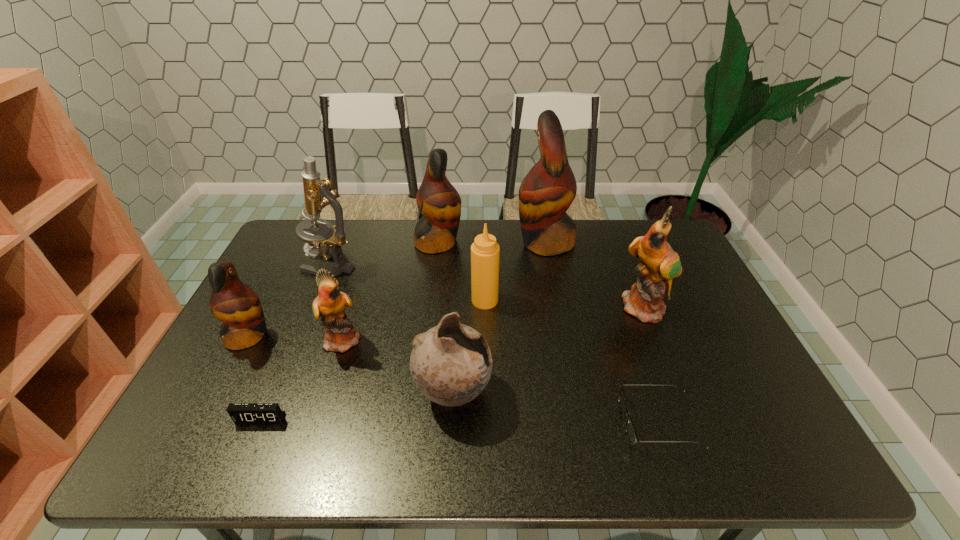
Locate an element on the screen. This screenshot has height=540, width=960. object that is the closest to the leftmost red parrot is located at coordinates (340, 335).

Point out which object is positioned as the fourth nearest to the bigger green parrot. Please provide its 2D coordinates. Your answer should be formatted as a tuple, i.e. [(x, y)], where the tuple contains the x and y coordinates of a point satisfying the conditions above.

[(451, 363)]

Locate an element on the screen. parrot identified as the fourth closest to the smallest red parrot is located at coordinates (660, 264).

Point out which parrot is positioned as the third nearest to the microscope. Please provide its 2D coordinates. Your answer should be formatted as a tuple, i.e. [(x, y)], where the tuple contains the x and y coordinates of a point satisfying the conditions above.

[(236, 304)]

Locate an element on the screen. The width and height of the screenshot is (960, 540). red parrot object that ranks as the third closest to the left green parrot is located at coordinates (547, 191).

Where is `red parrot that is the second closest one to the second smallest red parrot`? Image resolution: width=960 pixels, height=540 pixels. red parrot that is the second closest one to the second smallest red parrot is located at coordinates (236, 304).

This screenshot has width=960, height=540. What are the coordinates of `blank space that satisfies the following two spatial constraints: 1. on the face of the second smallest red parrot; 2. on the front-facing side of the alarm clock` in the screenshot? It's located at (418, 418).

This screenshot has height=540, width=960. Identify the location of free space that satisfies the following two spatial constraints: 1. on the face of the tallest parrot; 2. on the front side of the microscope. (549, 264).

Where is `vacant point that satisfies the following two spatial constraints: 1. on the front-facing side of the right green parrot; 2. through the lenses of the spectacles`? The image size is (960, 540). vacant point that satisfies the following two spatial constraints: 1. on the front-facing side of the right green parrot; 2. through the lenses of the spectacles is located at coordinates (691, 422).

Image resolution: width=960 pixels, height=540 pixels. In order to click on vacant space that satisfies the following two spatial constraints: 1. on the face of the third parrot from right to left; 2. on the back side of the condiment in this screenshot , I will do `click(432, 300)`.